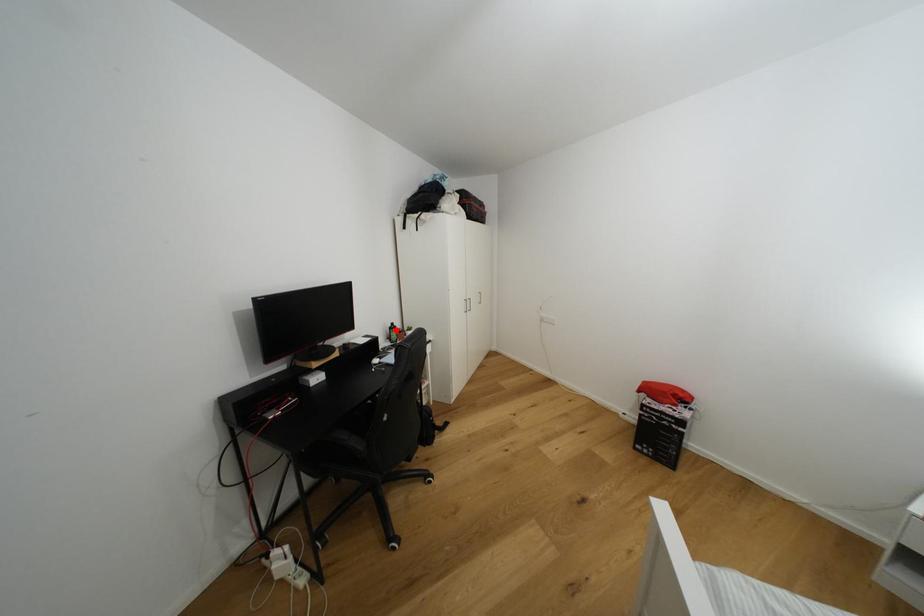
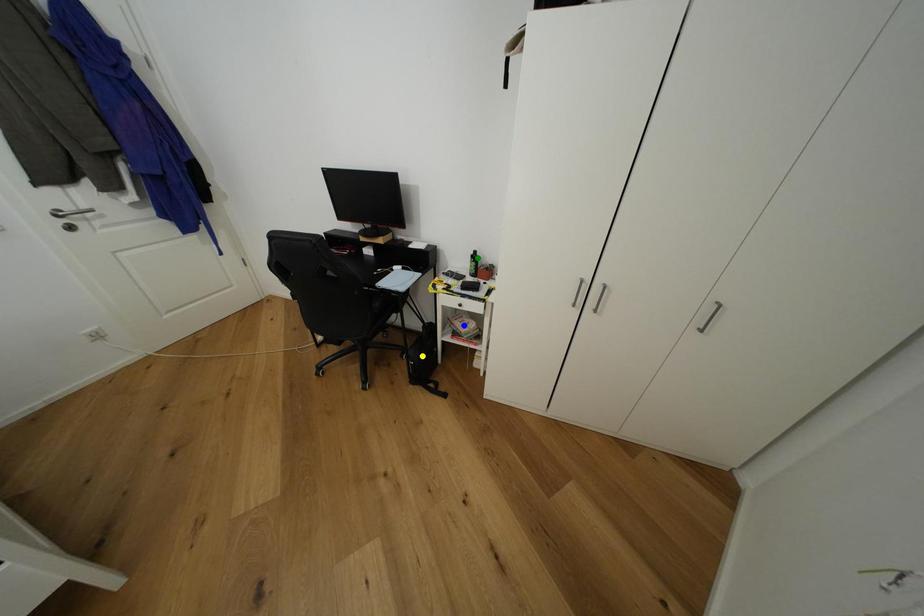
Question: I am providing you with two images of the same scene from different viewpoints. A red point is marked on the first image. You are given multiple points on the second image. Which point in image 2 is actually the same real-world point as the red point in image 1?

Choices:
 (A) yellow point
 (B) green point
 (C) blue point

Answer: (B)